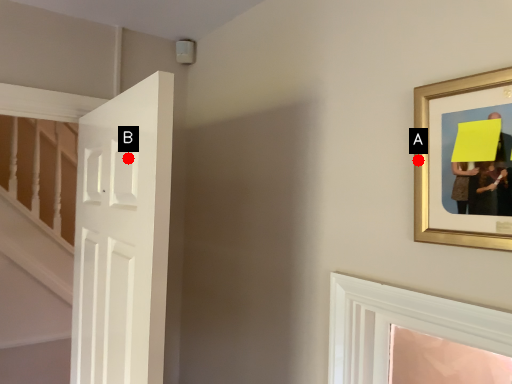
Question: Two points are circled on the image, labeled by A and B beside each circle. Among these points, which one is nearest to the camera?

Choices:
 (A) A is closer
 (B) B is closer

Answer: (A)